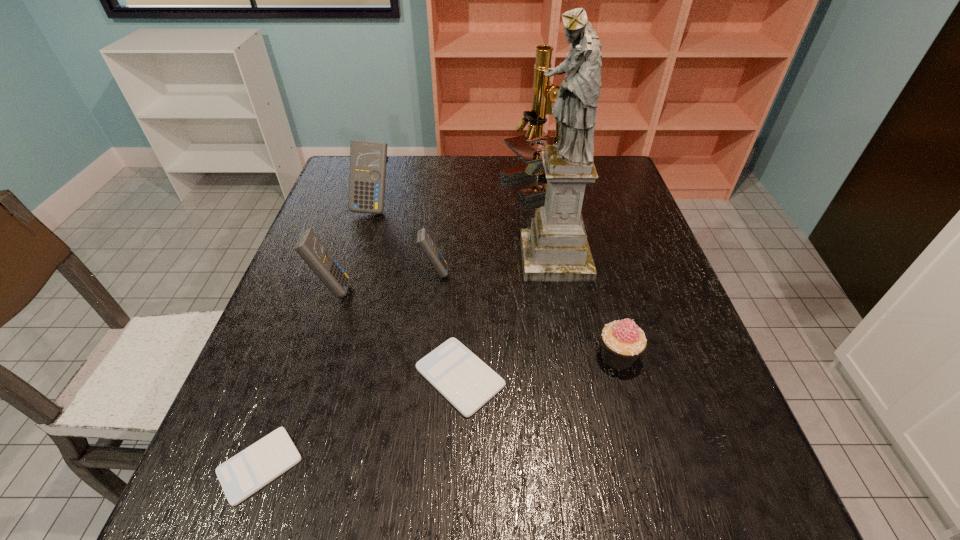
The height and width of the screenshot is (540, 960). Identify the location of vacant space in between the left white calculator and the cupcake. click(x=439, y=411).

Locate an element on the screen. empty space between the tallest calculator and the fifth shortest object is located at coordinates 352,248.

Find the location of a particular element. The width and height of the screenshot is (960, 540). free spot between the cupcake and the farthest calculator is located at coordinates (x=495, y=281).

I want to click on free point between the fourth farthest calculator and the farthest calculator, so click(x=417, y=292).

Find the location of a particular element. The width and height of the screenshot is (960, 540). vacant space in between the gold microscope and the rightmost blue calculator is located at coordinates (489, 228).

Identify the location of free space between the smallest blue calculator and the second biggest blue calculator. (383, 280).

Locate an element on the screen. This screenshot has height=540, width=960. free space between the farthest calculator and the pink cupcake is located at coordinates (495, 281).

Identify the location of empty space that is in between the cupcake and the smallest blue calculator. (526, 314).

Find the location of a particular element. The width and height of the screenshot is (960, 540). vacant area between the fourth shortest calculator and the second nearest calculator is located at coordinates (396, 333).

What are the coordinates of `empty location between the biggest blue calculator and the tallest object` in the screenshot? It's located at (465, 232).